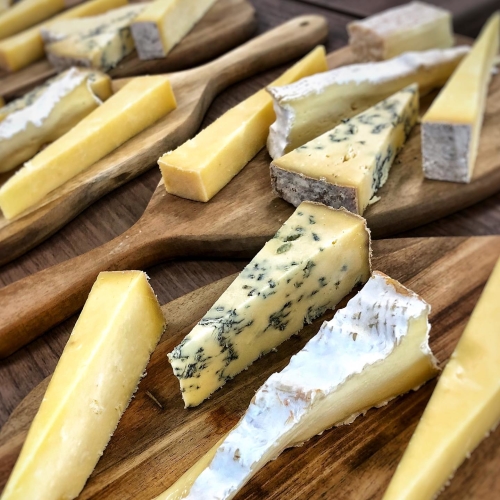
You are a GUI agent. You are given a task and a screenshot of the screen. Output one action in this format:
    pyautogui.click(x=<x>, y=<y>)
    Task: Click on the table
    This screenshot has width=500, height=500.
    Given the screenshot: What is the action you would take?
    pyautogui.click(x=104, y=213), pyautogui.click(x=186, y=269), pyautogui.click(x=471, y=216)